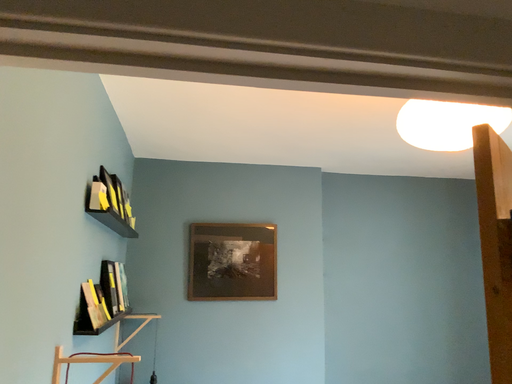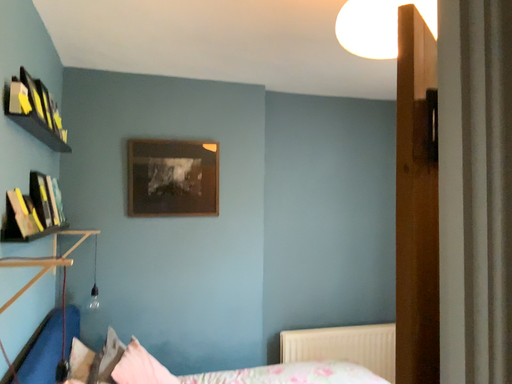
Question: How did the camera likely rotate when shooting the video?

Choices:
 (A) rotated upward
 (B) rotated downward

Answer: (B)